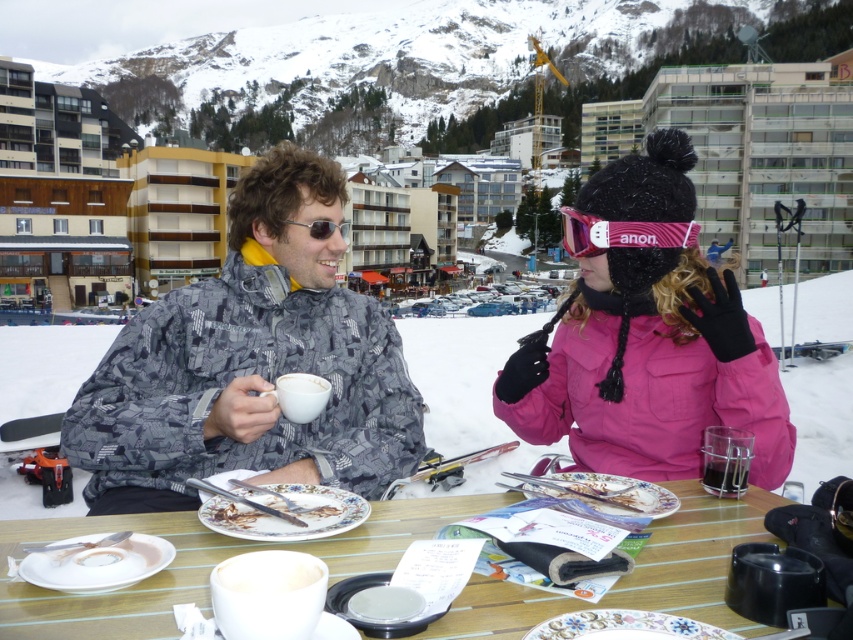
You are a photographer trying to capture a closeup of the clear plastic cup at lower center without the pink waterproof jacket at center blocking the view. Can you do this?

The pink waterproof jacket at center is taller than the clear plastic cup at lower center, so it might block the view. You need to move your camera position lower or angle it to avoid the jacket.

You are a server at the ski resort and need to deliver a new cup to the table. The clear plastic cup at lower center is already there. Where should you place the new white matte cup at center so it doesn

The white matte cup at center should be placed 3.43 meters away from the clear plastic cup at lower center to maintain the existing spacing between them.